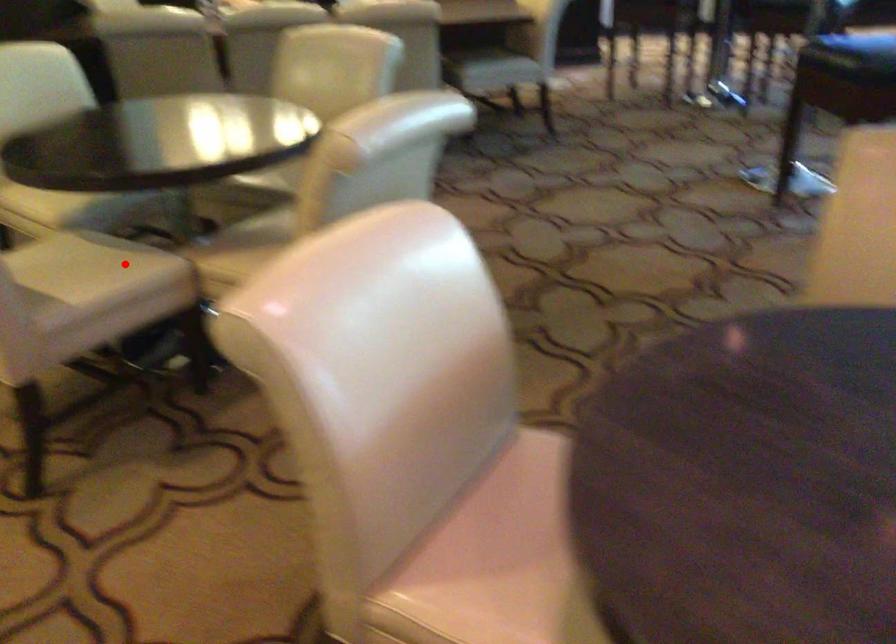
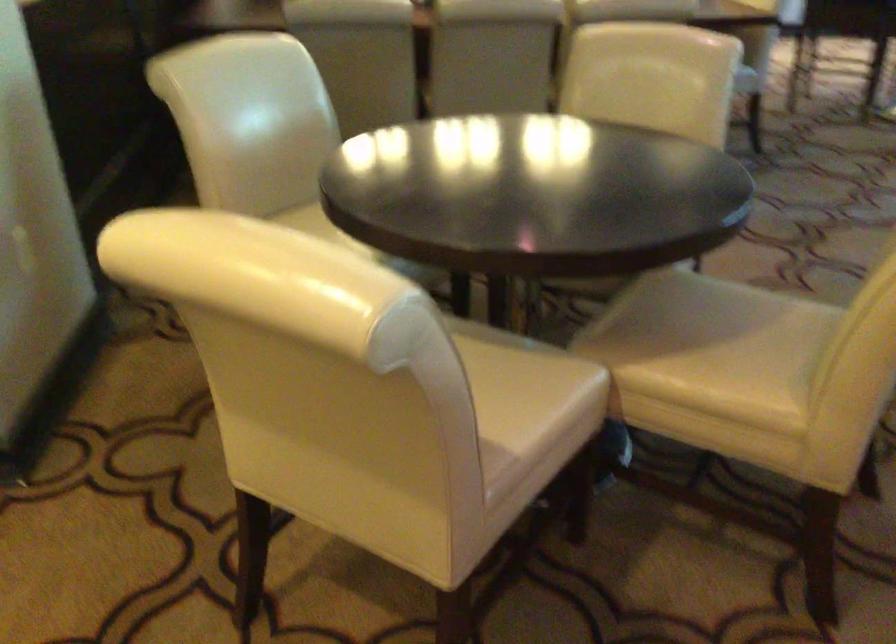
The point at the highlighted location is marked in the first image. Where is the corresponding point in the second image?

(530, 377)